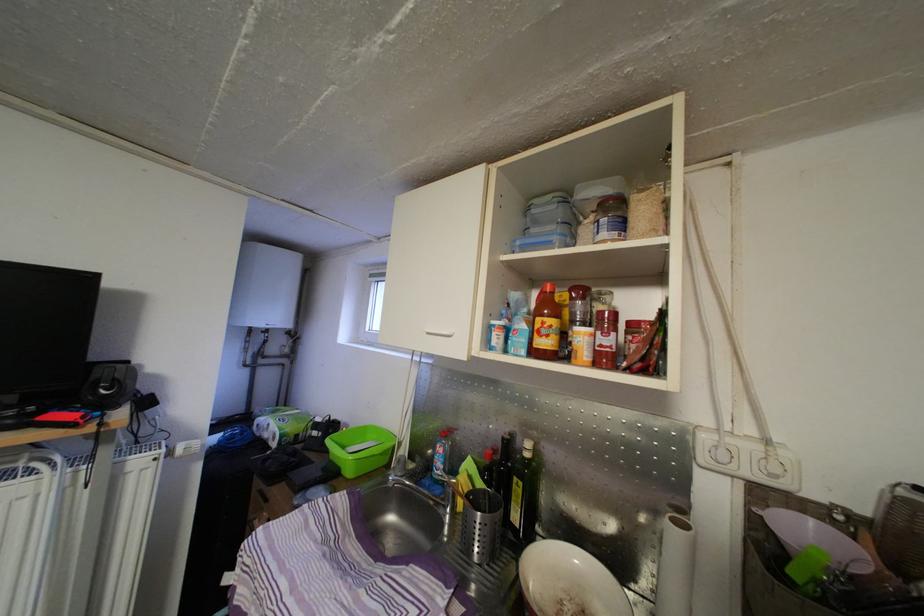
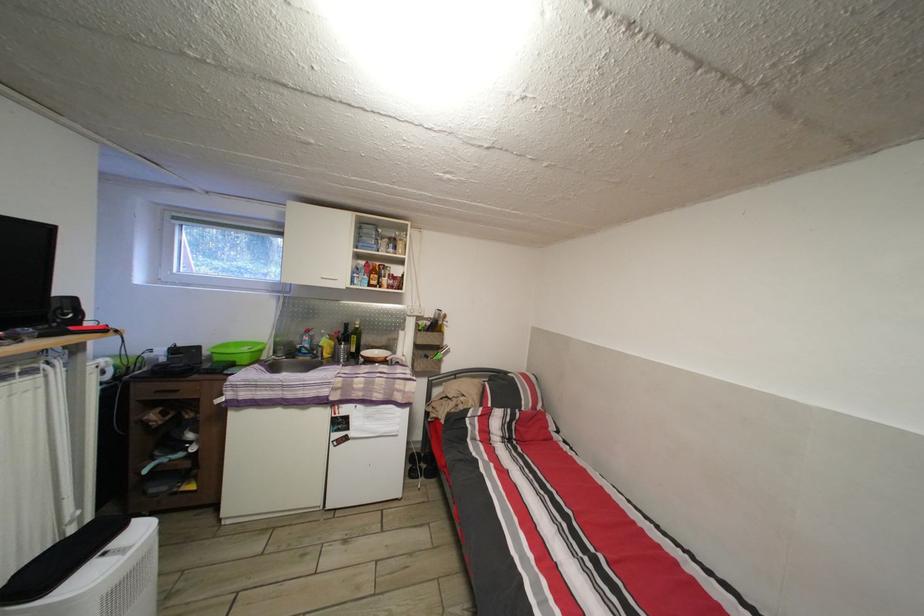
The point at (525, 493) is marked in the first image. Where is the corresponding point in the second image?

(360, 345)